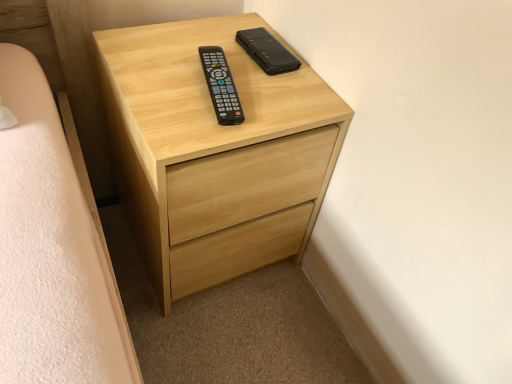
Question: Is black leather phone case at upper center, positioned as the 2th control in front-to-back order, far away from black plastic remote at center, the second control viewed from the back?

Choices:
 (A) no
 (B) yes

Answer: (A)

Question: From the image's perspective, is black leather phone case at upper center, positioned as the first control in back-to-front order, under black plastic remote at center, the second control viewed from the back?

Choices:
 (A) yes
 (B) no

Answer: (B)

Question: Is black leather phone case at upper center, positioned as the first control in back-to-front order, taller than black plastic remote at center, the second control viewed from the back?

Choices:
 (A) yes
 (B) no

Answer: (B)

Question: Can you confirm if black leather phone case at upper center, positioned as the first control in back-to-front order, is thinner than black plastic remote at center, the second control viewed from the back?

Choices:
 (A) yes
 (B) no

Answer: (A)

Question: Is black leather phone case at upper center, positioned as the 2th control in front-to-back order, positioned before black plastic remote at center, the second control viewed from the back?

Choices:
 (A) no
 (B) yes

Answer: (A)

Question: From the image's perspective, is black leather phone case at upper center, positioned as the first control in back-to-front order, located above or below black plastic remote at center, the second control viewed from the back?

Choices:
 (A) above
 (B) below

Answer: (A)

Question: Considering the positions of point (260, 61) and point (224, 112), is point (260, 61) closer or farther from the camera than point (224, 112)?

Choices:
 (A) closer
 (B) farther

Answer: (B)

Question: Is black leather phone case at upper center, positioned as the first control in back-to-front order, bigger or smaller than black plastic remote at center, which is counted as the 1th control, starting from the front?

Choices:
 (A) big
 (B) small

Answer: (B)

Question: In terms of width, does black leather phone case at upper center, positioned as the first control in back-to-front order, look wider or thinner when compared to black plastic remote at center, which is counted as the 1th control, starting from the front?

Choices:
 (A) wide
 (B) thin

Answer: (B)

Question: From the image's perspective, is black plastic remote at center, the second control viewed from the back, located above or below light wood chest of drawers at center?

Choices:
 (A) above
 (B) below

Answer: (A)

Question: Looking at their shapes, would you say black plastic remote at center, the second control viewed from the back, is wider or thinner than light wood chest of drawers at center?

Choices:
 (A) thin
 (B) wide

Answer: (A)

Question: Relative to light wood chest of drawers at center, is black plastic remote at center, which is counted as the 1th control, starting from the front, in front or behind?

Choices:
 (A) behind
 (B) front

Answer: (A)

Question: Is point (214, 84) positioned closer to the camera than point (183, 213)?

Choices:
 (A) closer
 (B) farther

Answer: (A)

Question: Looking at the image, does light wood chest of drawers at center seem bigger or smaller compared to black leather phone case at upper center, positioned as the 2th control in front-to-back order?

Choices:
 (A) big
 (B) small

Answer: (A)

Question: In the image, is light wood chest of drawers at center positioned in front of or behind black leather phone case at upper center, positioned as the first control in back-to-front order?

Choices:
 (A) behind
 (B) front

Answer: (B)